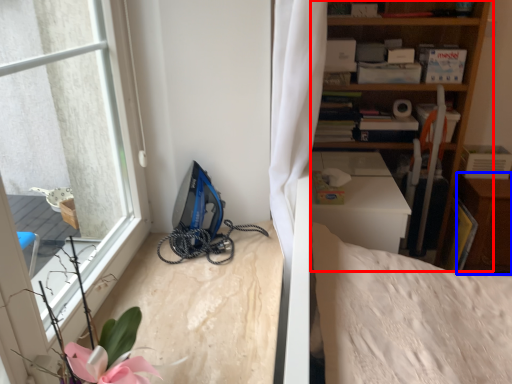
Question: Which object appears farthest to the camera in this image, shelf (highlighted by a red box) or dresser (highlighted by a blue box)?

Choices:
 (A) shelf
 (B) dresser

Answer: (B)